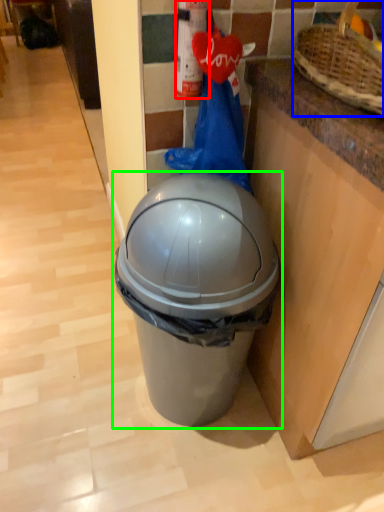
Question: Estimate the real-world distances between objects in this image. Which object is closer to extinguisher (highlighted by a red box), basket (highlighted by a blue box) or waste container (highlighted by a green box)?

Choices:
 (A) basket
 (B) waste container

Answer: (A)